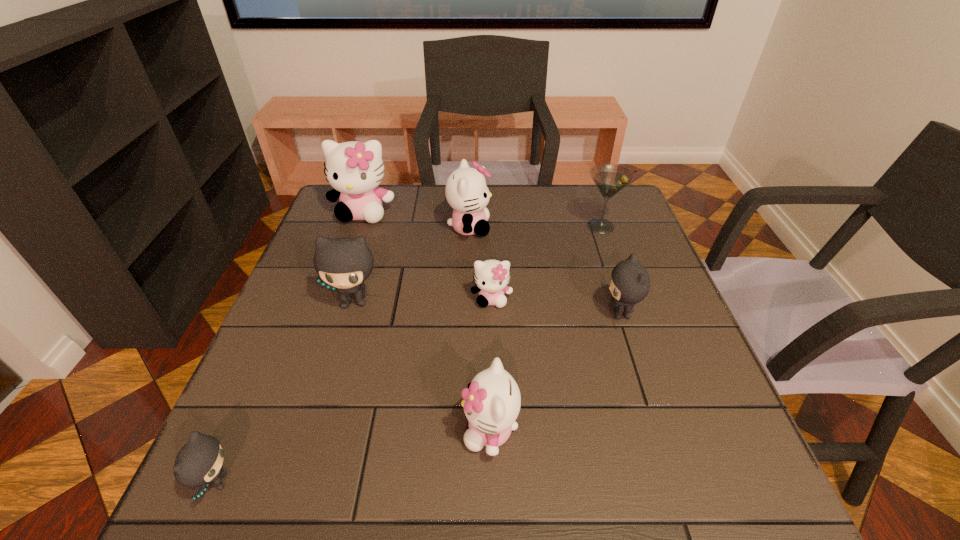
Locate an element on the screen. This screenshot has width=960, height=540. blank area located 0.180m on the front-facing side of the rightmost gray kitten is located at coordinates (525, 313).

The image size is (960, 540). I want to click on free region located 0.140m on the front-facing side of the second nearest white kitten, so click(493, 359).

What are the coordinates of `vacant space located 0.400m on the front-facing side of the smallest gray kitten` in the screenshot? It's located at (474, 482).

What are the coordinates of `martini present at the far edge` in the screenshot? It's located at (610, 179).

This screenshot has width=960, height=540. I want to click on martini situated at the right edge, so click(x=610, y=179).

Locate an element on the screen. This screenshot has height=540, width=960. kitten located at the right edge is located at coordinates (629, 284).

Identify the location of object at the far left corner. (354, 169).

The width and height of the screenshot is (960, 540). Identify the location of object located at the near left corner. (199, 462).

Find the location of a particular element. This screenshot has width=960, height=540. object present at the far right corner is located at coordinates (610, 179).

Where is `vacant area at the far edge of the desktop`? Image resolution: width=960 pixels, height=540 pixels. vacant area at the far edge of the desktop is located at coordinates (435, 212).